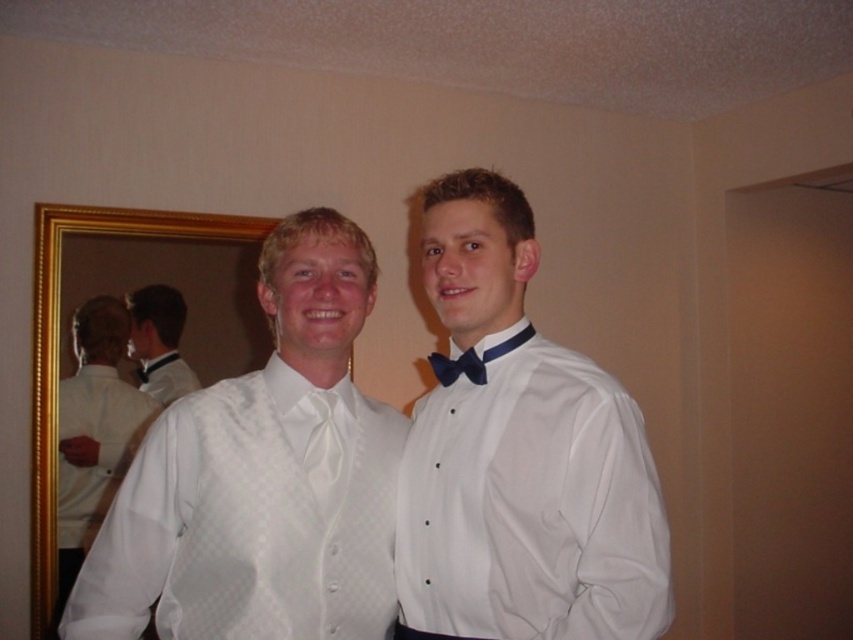
You are a photographer adjusting lighting in a studio. You need to ensure that the white satin shirt at left and the blue satin bow tie at center are both well lit. Based on their positions, which object should you adjust the light to reach first?

The blue satin bow tie at center is above the white satin shirt at left, so you should adjust the light to reach the blue satin bow tie at center first to ensure proper lighting on both objects.

You are standing in the room and want to hand a gift to the person wearing the white satin shirt at left. Based on their position in the image, which direction should you approach from?

The white satin shirt at left is positioned on the left side of the image, so you should approach from the left side to reach them directly.